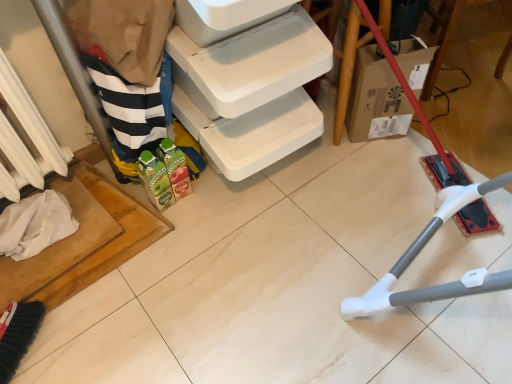
Question: From the image's perspective, would you say cardboard box at lower right is positioned over white plastic shelf at lower left?

Choices:
 (A) no
 (B) yes

Answer: (B)

Question: Is cardboard box at lower right outside white plastic shelf at lower left?

Choices:
 (A) yes
 (B) no

Answer: (A)

Question: Is cardboard box at lower right facing away from white plastic shelf at lower left?

Choices:
 (A) yes
 (B) no

Answer: (B)

Question: From the image's perspective, is cardboard box at lower right under white plastic shelf at lower left?

Choices:
 (A) yes
 (B) no

Answer: (B)

Question: From a real-world perspective, does cardboard box at lower right stand above white plastic shelf at lower left?

Choices:
 (A) yes
 (B) no

Answer: (B)

Question: Is white painted metal radiator at left to the left or to the right of cardboard box at lower right in the image?

Choices:
 (A) right
 (B) left

Answer: (B)

Question: Would you say white painted metal radiator at left is inside or outside cardboard box at lower right?

Choices:
 (A) outside
 (B) inside

Answer: (A)

Question: From their relative heights in the image, would you say white painted metal radiator at left is taller or shorter than cardboard box at lower right?

Choices:
 (A) short
 (B) tall

Answer: (B)

Question: From the image's perspective, is white painted metal radiator at left above or below cardboard box at lower right?

Choices:
 (A) below
 (B) above

Answer: (A)

Question: Is cardboard box at lower right to the left or to the right of white painted metal radiator at left in the image?

Choices:
 (A) right
 (B) left

Answer: (A)

Question: From the image's perspective, relative to white painted metal radiator at left, is cardboard box at lower right above or below?

Choices:
 (A) below
 (B) above

Answer: (B)

Question: Looking at the image, does cardboard box at lower right seem bigger or smaller compared to white painted metal radiator at left?

Choices:
 (A) big
 (B) small

Answer: (A)

Question: From their relative heights in the image, would you say cardboard box at lower right is taller or shorter than white painted metal radiator at left?

Choices:
 (A) short
 (B) tall

Answer: (A)

Question: Looking at their shapes, would you say cardboard box at lower right is wider or thinner than white plastic shelf at lower left?

Choices:
 (A) thin
 (B) wide

Answer: (A)

Question: From their relative heights in the image, would you say cardboard box at lower right is taller or shorter than white plastic shelf at lower left?

Choices:
 (A) short
 (B) tall

Answer: (A)